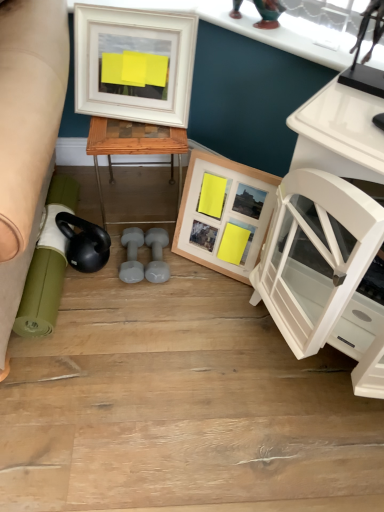
Identify the location of free point to the right of green rubber mat at lower left. The height and width of the screenshot is (512, 384). (165, 295).